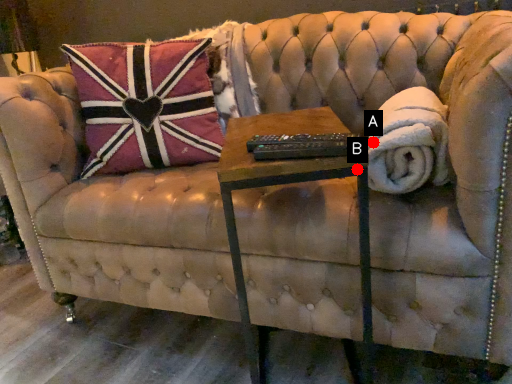
Question: Two points are circled on the image, labeled by A and B beside each circle. Which point appears farthest from the camera in this image?

Choices:
 (A) A is further
 (B) B is further

Answer: (A)